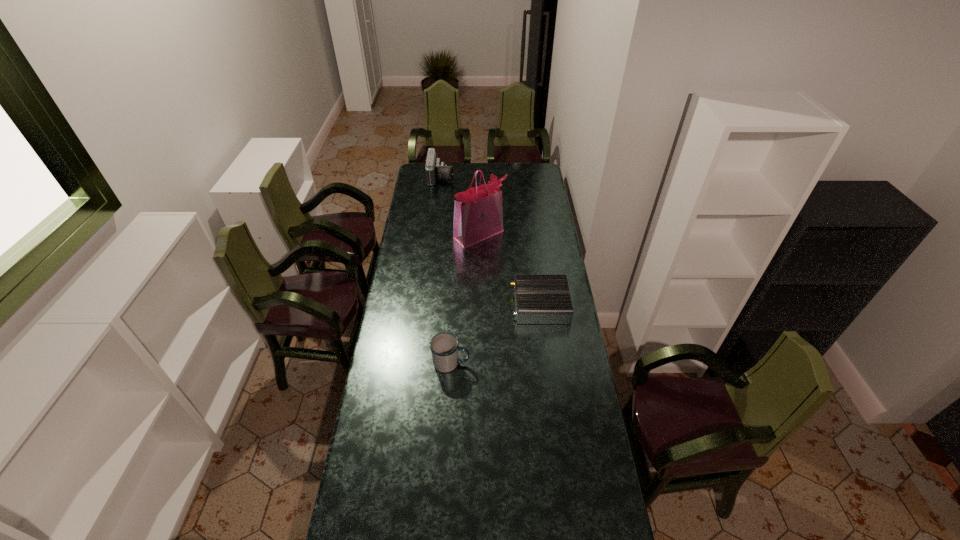
I want to click on vacant point that satisfies the following two spatial constraints: 1. at the front of the shopping bag with an open lens cover; 2. on the right side of the farthest object, so click(434, 234).